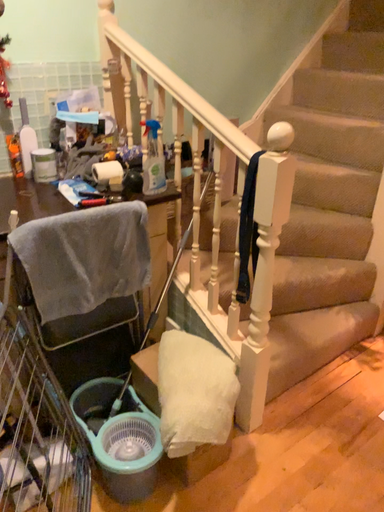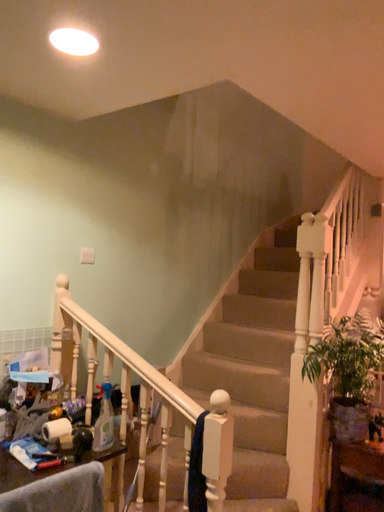
Question: How did the camera likely rotate when shooting the video?

Choices:
 (A) rotated right
 (B) rotated left

Answer: (A)